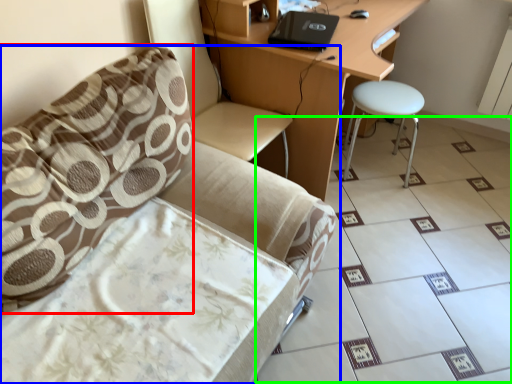
Question: Which is nearer to the pillow (highlighted by a red box)? chair (highlighted by a blue box) or ceramic tile (highlighted by a green box).

Choices:
 (A) chair
 (B) ceramic tile

Answer: (A)